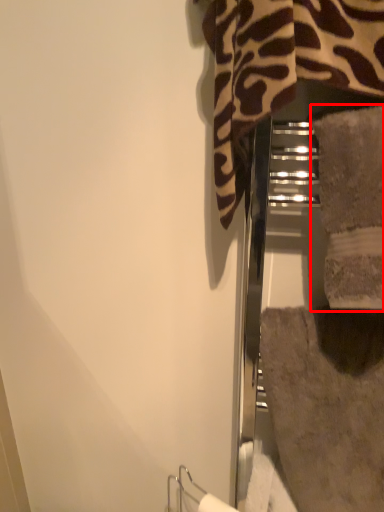
Question: From the image's perspective, considering the relative positions of towel (annotated by the red box) and bath towel in the image provided, where is towel (annotated by the red box) located with respect to the staircase?

Choices:
 (A) below
 (B) above

Answer: (B)